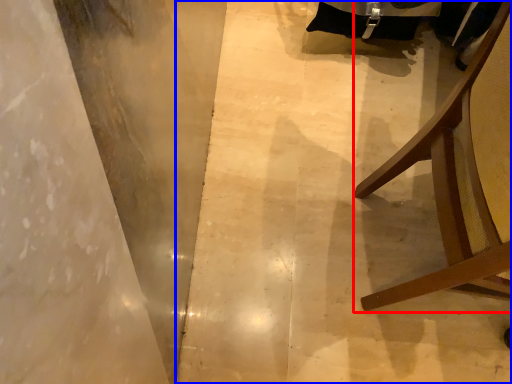
Question: Among these objects, which one is nearest to the camera, furniture (highlighted by a red box) or concrete (highlighted by a blue box)?

Choices:
 (A) furniture
 (B) concrete

Answer: (A)